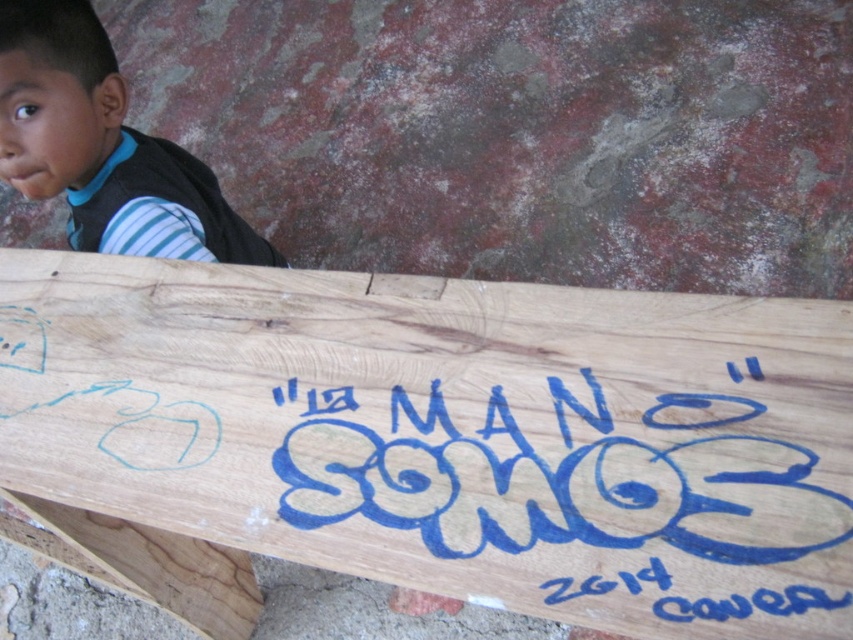
Question: Which of the following is the farthest from the observer?

Choices:
 (A) (157, 166)
 (B) (352, 422)

Answer: (A)

Question: Where is natural wood sign at lower center located in relation to striped fabric shirt at upper left in the image?

Choices:
 (A) below
 (B) above

Answer: (A)

Question: Does blue painted graffiti at center have a smaller size compared to striped fabric shirt at upper left?

Choices:
 (A) yes
 (B) no

Answer: (A)

Question: Which of the following is the farthest from the observer?

Choices:
 (A) striped fabric shirt at upper left
 (B) blue painted graffiti at center
 (C) natural wood sign at lower center

Answer: (A)

Question: Which is farther from the blue painted graffiti at center?

Choices:
 (A) striped fabric shirt at upper left
 (B) natural wood sign at lower center

Answer: (A)

Question: In this image, where is natural wood sign at lower center located relative to blue painted graffiti at center?

Choices:
 (A) below
 (B) above

Answer: (A)